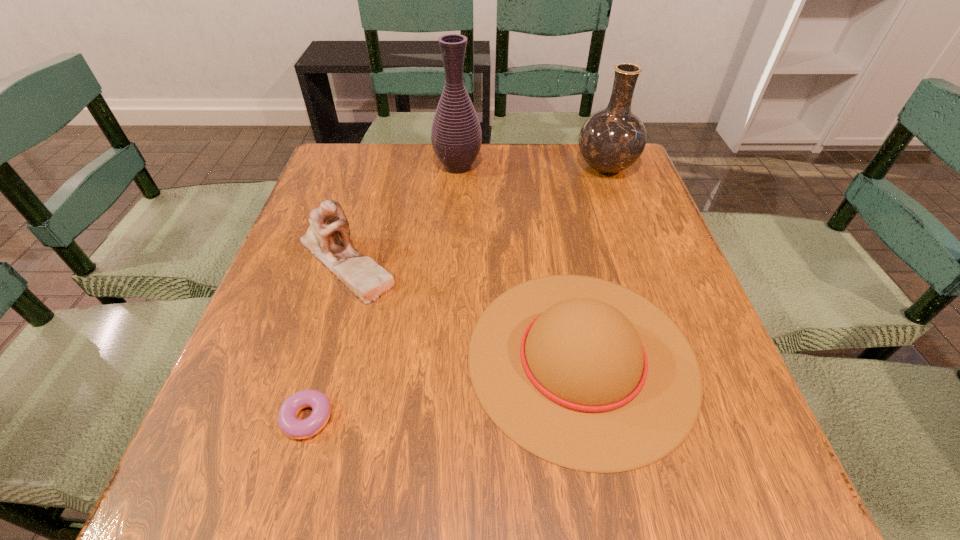
You are a GUI agent. You are given a task and a screenshot of the screen. Output one action in this format:
    pyautogui.click(x=<x>, y=<y>)
    Task: Click on the object located at the near right corner
    
    Given the screenshot: What is the action you would take?
    pyautogui.click(x=584, y=373)

This screenshot has width=960, height=540. Identify the location of vacant space at the far edge of the desktop. (494, 155).

In the image, there is a desktop. Identify the location of vacant space at the left edge. This screenshot has width=960, height=540. (291, 348).

Find the location of a particular element. This screenshot has width=960, height=540. free space at the right edge of the desktop is located at coordinates (660, 248).

At what (x,y) coordinates should I click in order to perform the action: click on free space at the far right corner of the desktop. Please return your answer as a coordinate pair (x, y). The image size is (960, 540). Looking at the image, I should click on (590, 171).

I want to click on free space that is in between the tallest object and the third tallest object, so click(402, 214).

Identify the location of vacant space that's between the fourth tallest object and the right vase. This screenshot has height=540, width=960. (594, 262).

At what (x,y) coordinates should I click in order to perform the action: click on free point between the figurine and the shorter vase. Please return your answer as a coordinate pair (x, y). This screenshot has height=540, width=960. Looking at the image, I should click on tap(476, 214).

Locate an element on the screen. This screenshot has height=540, width=960. free point between the shortest object and the second tallest object is located at coordinates (456, 296).

Find the location of a particular element. blank region between the right vase and the shortest object is located at coordinates (456, 296).